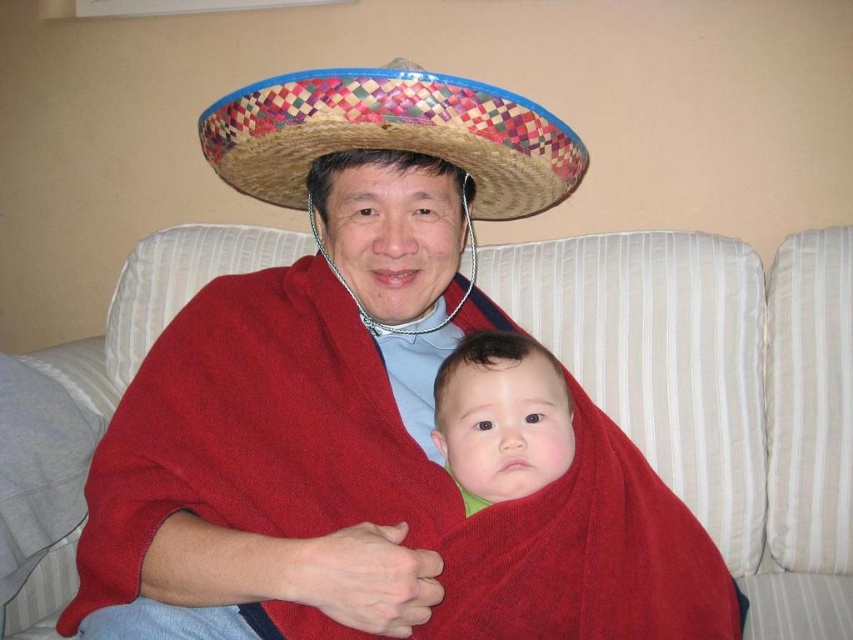
Question: From the image, what is the correct spatial relationship of woven straw sombrero at center in relation to smooth red fabric at center?

Choices:
 (A) left
 (B) right

Answer: (A)

Question: From the image, what is the correct spatial relationship of white striped couch at center in relation to smooth red fabric at center?

Choices:
 (A) right
 (B) left

Answer: (A)

Question: Which object appears farthest from the camera in this image?

Choices:
 (A) white striped couch at center
 (B) smooth red fabric at center

Answer: (A)

Question: Among these objects, which one is nearest to the camera?

Choices:
 (A) woven straw sombrero at center
 (B) smooth red fabric at center

Answer: (A)

Question: Is woven straw sombrero at center above smooth red fabric at center?

Choices:
 (A) yes
 (B) no

Answer: (A)

Question: Which object is closer to the camera taking this photo?

Choices:
 (A) woven straw sombrero at center
 (B) smooth red fabric at center
 (C) white striped couch at center

Answer: (A)